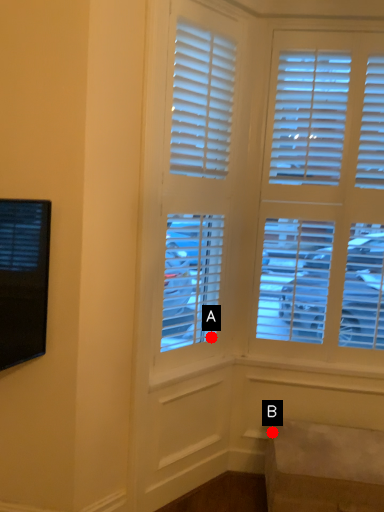
Question: Two points are circled on the image, labeled by A and B beside each circle. Which point is farther to the camera?

Choices:
 (A) A is further
 (B) B is further

Answer: (A)